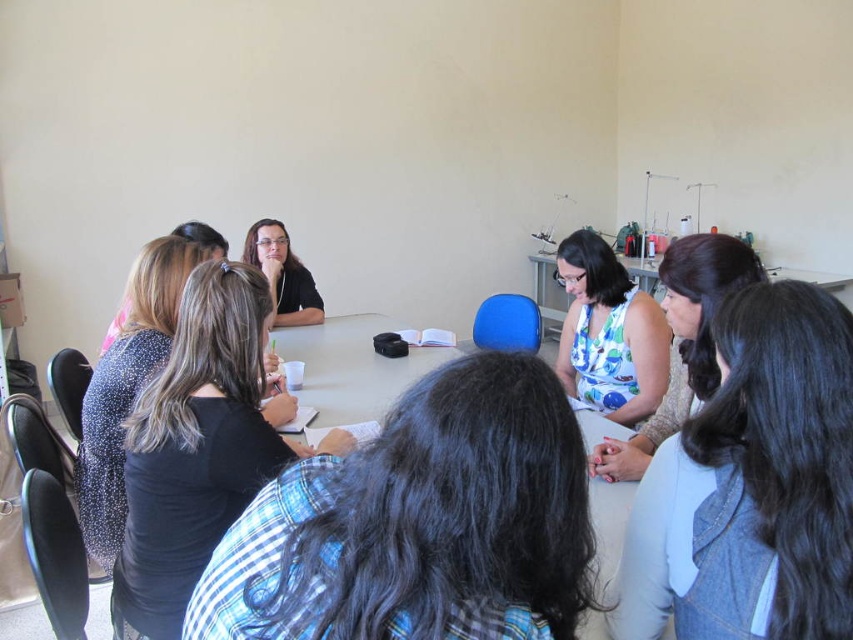
Is speckled fabric shirt at left shorter than black textured shirt at upper left?

No, speckled fabric shirt at left is not shorter than black textured shirt at upper left.

Describe the element at coordinates (126, 387) in the screenshot. Image resolution: width=853 pixels, height=640 pixels. I see `speckled fabric shirt at left` at that location.

You are a GUI agent. You are given a task and a screenshot of the screen. Output one action in this format:
    pyautogui.click(x=<x>, y=<y>)
    Task: Click on the speckled fabric shirt at left
    This screenshot has height=640, width=853.
    Given the screenshot: What is the action you would take?
    pyautogui.click(x=126, y=387)

Can you confirm if speckled fabric shirt at left is positioned to the left of white plastic table at center?

Yes, speckled fabric shirt at left is to the left of white plastic table at center.

The image size is (853, 640). What are the coordinates of `speckled fabric shirt at left` in the screenshot? It's located at (126, 387).

In order to click on speckled fabric shirt at left in this screenshot , I will do `click(126, 387)`.

Between black matte shirt at upper left and floral fabric dress at center, which one has more height?

With more height is black matte shirt at upper left.

Does black matte shirt at upper left appear on the right side of floral fabric dress at center?

In fact, black matte shirt at upper left is to the left of floral fabric dress at center.

Where is `black matte shirt at upper left`? black matte shirt at upper left is located at coordinates (194, 449).